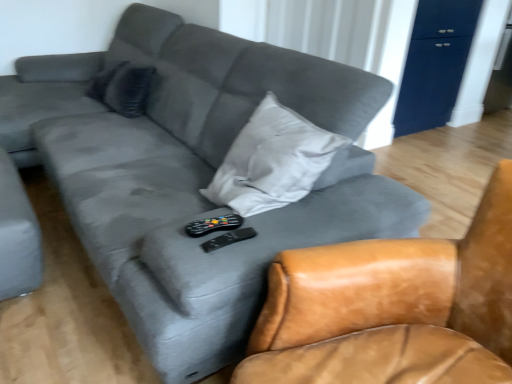
Question: From a real-world perspective, is matte dark blue dresser at upper right physically located above or below dark gray fabric pillow at upper left?

Choices:
 (A) below
 (B) above

Answer: (A)

Question: From the image's perspective, is matte dark blue dresser at upper right positioned above or below dark gray fabric pillow at upper left?

Choices:
 (A) above
 (B) below

Answer: (A)

Question: Which of these objects is positioned closest to the matte dark blue dresser at upper right?

Choices:
 (A) dark gray fabric pillow at upper left
 (B) black plastic remote at center, acting as the second remote starting from the bottom
 (C) leather armchair at center
 (D) black plastic remote at center, marked as the 1th remote in a bottom-to-top arrangement

Answer: (A)

Question: Which of these objects is positioned closest to the dark gray fabric pillow at upper left?

Choices:
 (A) black plastic remote at center, marked as the 1th remote in a bottom-to-top arrangement
 (B) black plastic remote at center, acting as the second remote starting from the bottom
 (C) matte dark blue dresser at upper right
 (D) leather armchair at center

Answer: (B)